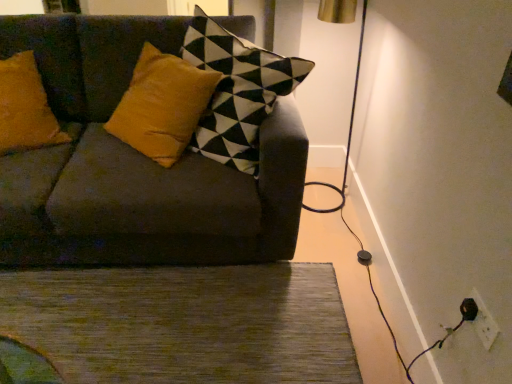
Question: Does white plastic electric outlet at lower right have a greater width compared to velvet dark gray couch at center?

Choices:
 (A) yes
 (B) no

Answer: (B)

Question: Does white plastic electric outlet at lower right have a lesser width compared to velvet dark gray couch at center?

Choices:
 (A) yes
 (B) no

Answer: (A)

Question: Is white plastic electric outlet at lower right closer to the viewer compared to velvet dark gray couch at center?

Choices:
 (A) no
 (B) yes

Answer: (B)

Question: From a real-world perspective, is white plastic electric outlet at lower right located higher than velvet dark gray couch at center?

Choices:
 (A) no
 (B) yes

Answer: (A)

Question: Can you confirm if white plastic electric outlet at lower right is positioned to the left of velvet dark gray couch at center?

Choices:
 (A) no
 (B) yes

Answer: (A)

Question: Is point (91, 283) closer or farther from the camera than point (477, 311)?

Choices:
 (A) closer
 (B) farther

Answer: (B)

Question: Is green textured rug at lower center in front of or behind white plastic electric outlet at lower right in the image?

Choices:
 (A) front
 (B) behind

Answer: (B)

Question: From the image's perspective, is green textured rug at lower center above or below white plastic electric outlet at lower right?

Choices:
 (A) below
 (B) above

Answer: (A)

Question: Visually, is green textured rug at lower center positioned to the left or to the right of white plastic electric outlet at lower right?

Choices:
 (A) left
 (B) right

Answer: (A)

Question: Would you say velvet dark gray couch at center is inside or outside green textured rug at lower center?

Choices:
 (A) inside
 (B) outside

Answer: (B)

Question: From the image's perspective, is velvet dark gray couch at center above or below green textured rug at lower center?

Choices:
 (A) above
 (B) below

Answer: (A)

Question: In terms of height, does velvet dark gray couch at center look taller or shorter compared to green textured rug at lower center?

Choices:
 (A) tall
 (B) short

Answer: (A)

Question: Would you say velvet dark gray couch at center is to the left or to the right of green textured rug at lower center in the picture?

Choices:
 (A) right
 (B) left

Answer: (B)

Question: In terms of width, does green textured rug at lower center look wider or thinner when compared to velvet dark gray couch at center?

Choices:
 (A) thin
 (B) wide

Answer: (B)

Question: Based on their sizes in the image, would you say green textured rug at lower center is bigger or smaller than velvet dark gray couch at center?

Choices:
 (A) small
 (B) big

Answer: (A)